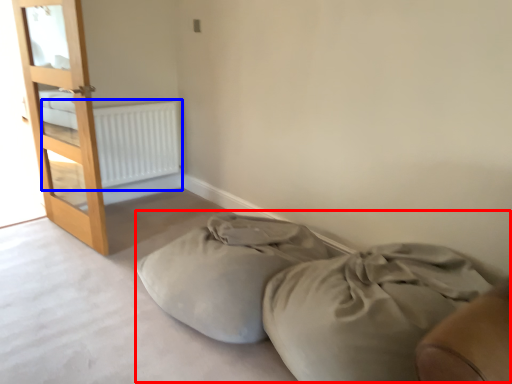
Question: Among these objects, which one is farthest to the camera, bed frame (highlighted by a red box) or radiator (highlighted by a blue box)?

Choices:
 (A) bed frame
 (B) radiator

Answer: (B)